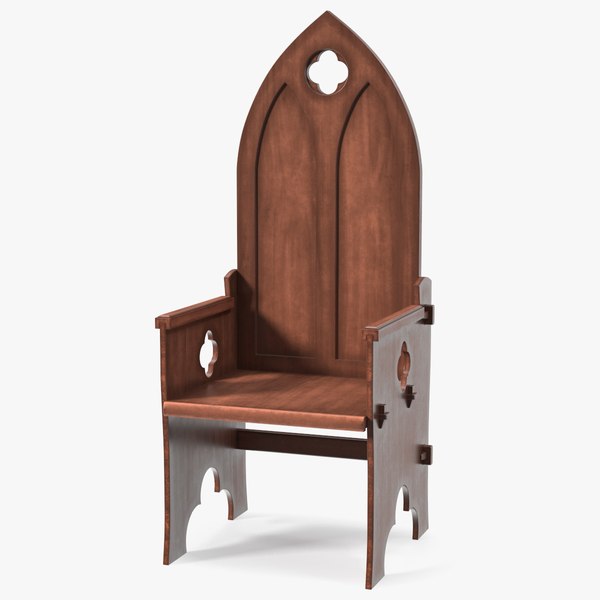
Locate an element on the screen. back rest curves upwards is located at coordinates (256, 98), (401, 98), (330, 12).